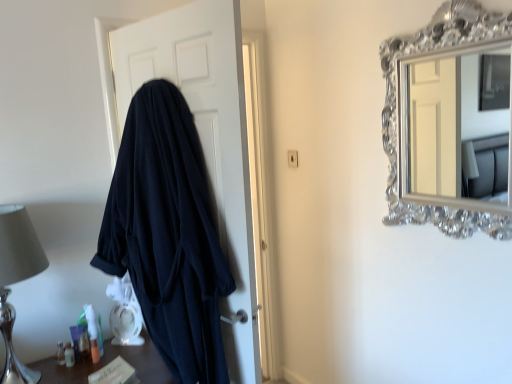
Question: Considering their positions, is translucent plastic toiletries at lower left located in front of or behind silver metallic table lamp at left?

Choices:
 (A) front
 (B) behind

Answer: (A)

Question: In terms of height, does translucent plastic toiletries at lower left look taller or shorter compared to silver metallic table lamp at left?

Choices:
 (A) tall
 (B) short

Answer: (B)

Question: Which is nearer to the silver metallic table lamp at left?

Choices:
 (A) translucent plastic container at lower left, the first toiletry from the left
 (B) dark blue robe at left
 (C) translucent plastic tube at lower left, positioned as the 1th toiletry in right-to-left order
 (D) translucent plastic toiletries at lower left

Answer: (A)

Question: Which of these objects is positioned closest to the dark blue robe at left?

Choices:
 (A) translucent plastic tube at lower left, acting as the second toiletry starting from the left
 (B) translucent plastic container at lower left, the 2th toiletry positioned from the right
 (C) translucent plastic toiletries at lower left
 (D) silver metallic table lamp at left

Answer: (D)